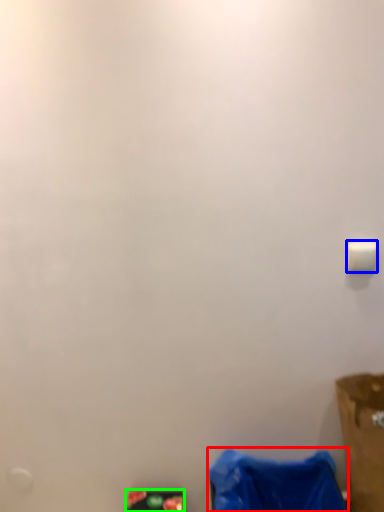
Question: Which object is positioned closest to waste (highlighted by a red box)? Select from light switch (highlighted by a blue box) and waste (highlighted by a green box).

Choices:
 (A) light switch
 (B) waste

Answer: (B)